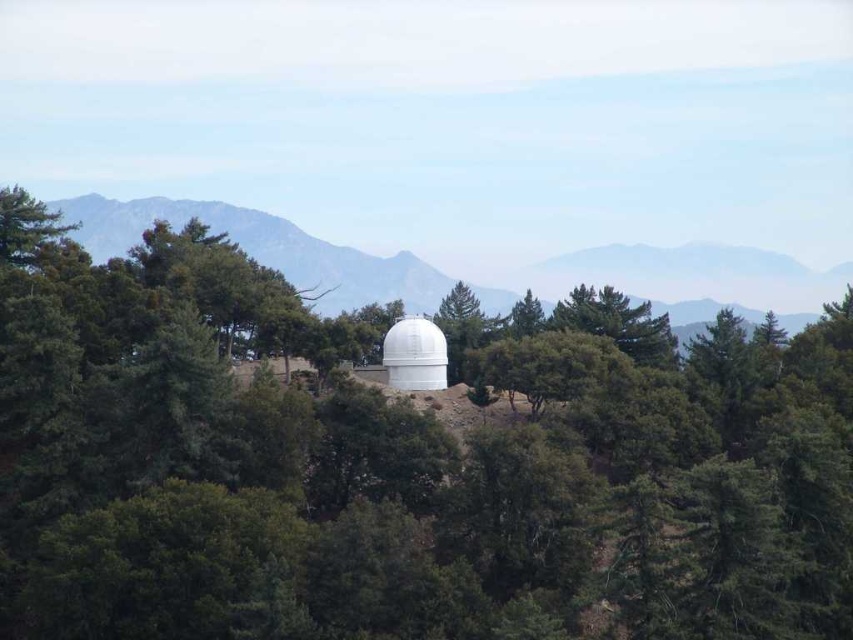
Question: Which object appears closest to the camera in this image?

Choices:
 (A) white smooth dome at center
 (B) green matte forest at center

Answer: (B)

Question: Considering the relative positions of green matte forest at center and white smooth dome at center in the image provided, where is green matte forest at center located with respect to white smooth dome at center?

Choices:
 (A) right
 (B) left

Answer: (B)

Question: Which point is farther from the camera taking this photo?

Choices:
 (A) (804, 272)
 (B) (440, 579)

Answer: (A)

Question: Does green matte forest at center appear under white smooth dome at center?

Choices:
 (A) yes
 (B) no

Answer: (A)

Question: Does green matte forest at center have a smaller size compared to white smooth dome at center?

Choices:
 (A) no
 (B) yes

Answer: (B)

Question: Which of the following is the farthest from the observer?

Choices:
 (A) (842, 504)
 (B) (349, 291)

Answer: (B)